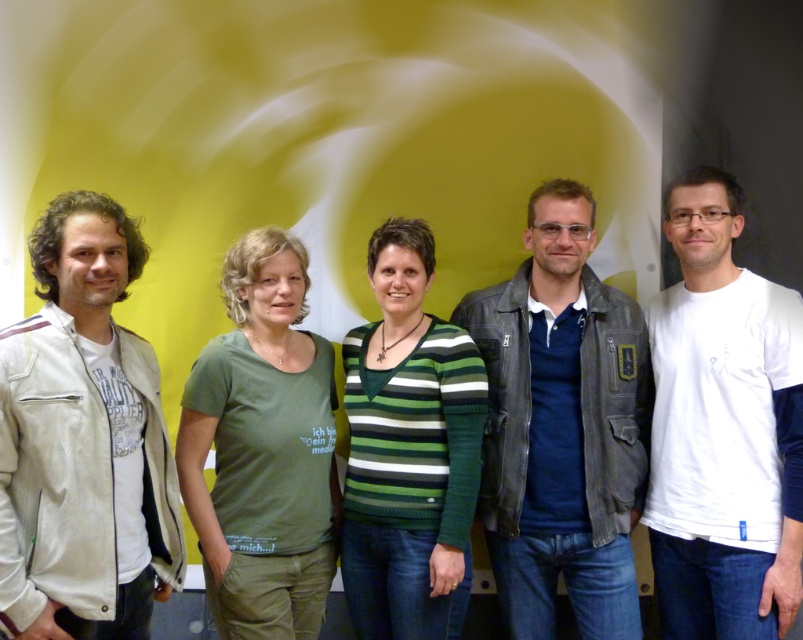
You are a fashion designer evaluating clothing sizes for a photoshoot. You have a white cotton jacket at left and a green striped sweater at center. Which item would require more fabric to produce?

The white cotton jacket at left requires more fabric because it has a larger size compared to the green striped sweater at center.